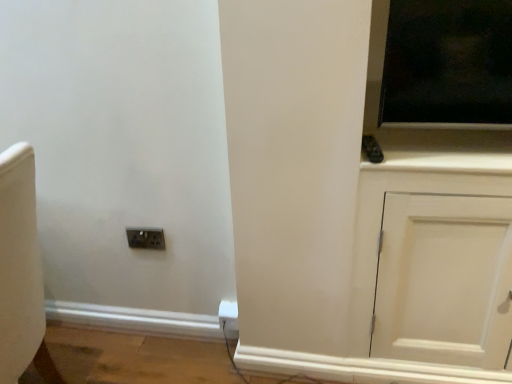
Question: From a real-world perspective, is white plastic electric outlet at lower center positioned above or below metallic socket at lower left?

Choices:
 (A) above
 (B) below

Answer: (B)

Question: In terms of height, does white plastic electric outlet at lower center look taller or shorter compared to metallic socket at lower left?

Choices:
 (A) short
 (B) tall

Answer: (B)

Question: Estimate the real-world distances between objects in this image. Which object is farther from the white plastic electric outlet at lower center?

Choices:
 (A) metallic socket at lower left
 (B) white matte cabinet at right

Answer: (B)

Question: Based on their relative distances, which object is nearer to the white matte cabinet at right?

Choices:
 (A) metallic socket at lower left
 (B) white plastic electric outlet at lower center

Answer: (B)